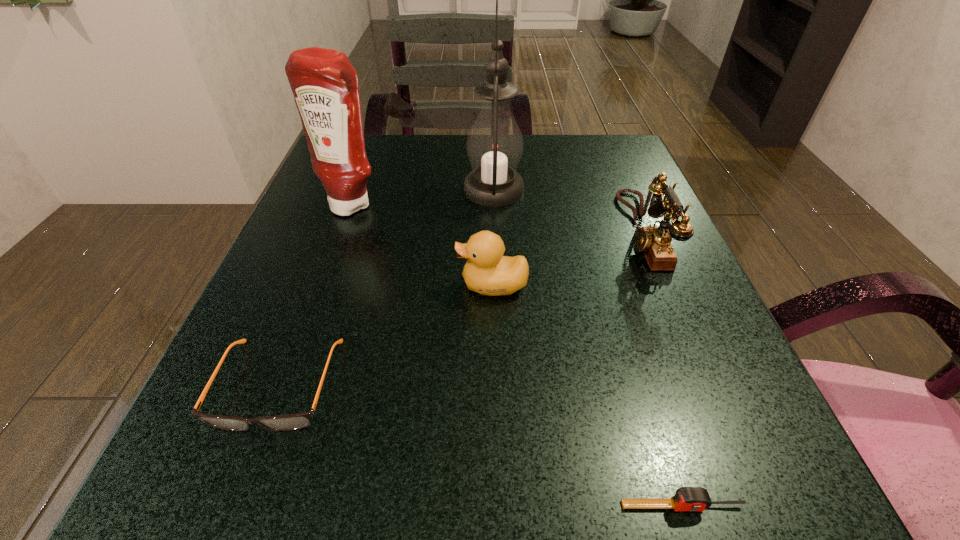
In order to click on the third closest object relative to the spectacles in this screenshot , I will do `click(494, 145)`.

The image size is (960, 540). I want to click on the fifth closest object relative to the duckling, so click(686, 498).

You are a GUI agent. You are given a task and a screenshot of the screen. Output one action in this format:
    pyautogui.click(x=<x>, y=<y>)
    Task: Click on the vacant area that satisfies the following two spatial constraints: 1. facing forward on the third shortest object; 2. on the front-facing side of the fifth farthest object
    The width and height of the screenshot is (960, 540).
    Given the screenshot: What is the action you would take?
    pyautogui.click(x=495, y=384)

This screenshot has width=960, height=540. I want to click on free space that satisfies the following two spatial constraints: 1. on the front-facing side of the fourth shortest object; 2. on the front-facing side of the fifth farthest object, so click(706, 384).

This screenshot has width=960, height=540. I want to click on free space that satisfies the following two spatial constraints: 1. facing forward on the fourth tallest object; 2. on the front-facing side of the second shortest object, so click(495, 384).

The height and width of the screenshot is (540, 960). In order to click on vacant region that satisfies the following two spatial constraints: 1. on the front-facing side of the fifth tallest object; 2. on the right side of the shortest object in this screenshot , I will do `click(232, 506)`.

Image resolution: width=960 pixels, height=540 pixels. I want to click on free region that satisfies the following two spatial constraints: 1. facing forward on the duckling; 2. on the front-facing side of the spectacles, so click(495, 384).

Image resolution: width=960 pixels, height=540 pixels. I want to click on free location that satisfies the following two spatial constraints: 1. on the front-facing side of the tape measure; 2. on the left side of the fifth tallest object, so click(232, 506).